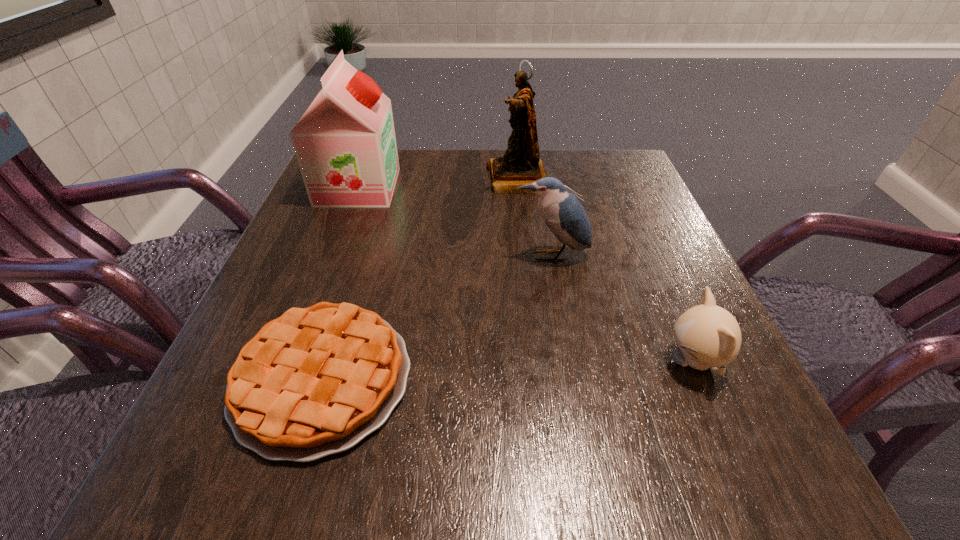
Identify the location of free space located 0.260m on the front-facing side of the figurine. This screenshot has height=540, width=960. (378, 180).

Image resolution: width=960 pixels, height=540 pixels. I want to click on free space located at the tip of the third tallest object's beak, so click(569, 356).

Locate an element on the screen. The height and width of the screenshot is (540, 960). vacant space situated on the face of the fourth tallest object is located at coordinates (508, 361).

The width and height of the screenshot is (960, 540). I want to click on vacant space situated 0.270m on the face of the fourth tallest object, so click(x=488, y=361).

The height and width of the screenshot is (540, 960). Identify the location of vacant space located on the face of the fourth tallest object. (580, 361).

The width and height of the screenshot is (960, 540). Identify the location of free space located on the right of the pie. (608, 379).

This screenshot has height=540, width=960. What are the coordinates of `soya milk that is at the far edge` in the screenshot? It's located at (345, 144).

The height and width of the screenshot is (540, 960). I want to click on figurine present at the far edge, so click(521, 165).

Where is `object that is at the near edge`? The height and width of the screenshot is (540, 960). object that is at the near edge is located at coordinates [316, 381].

Find the location of a particular element. The height and width of the screenshot is (540, 960). soya milk located at the left edge is located at coordinates (345, 144).